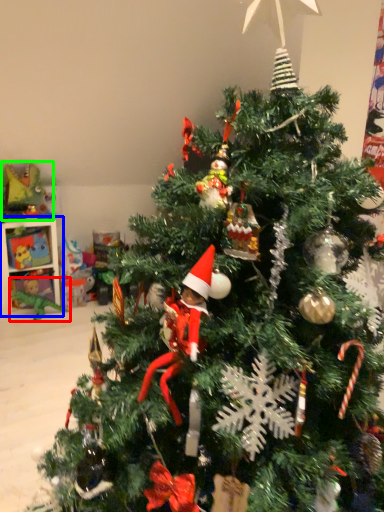
Question: Which object is positioned farthest from toy (highlighted by a red box)? Select from shelf (highlighted by a blue box) and toy (highlighted by a green box).

Choices:
 (A) shelf
 (B) toy

Answer: (B)